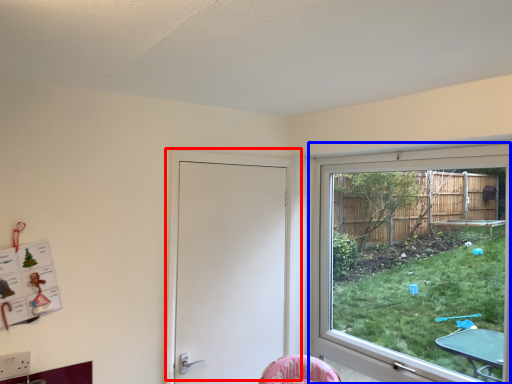
Question: Among these objects, which one is farthest to the camera, door (highlighted by a red box) or window (highlighted by a blue box)?

Choices:
 (A) door
 (B) window

Answer: (A)